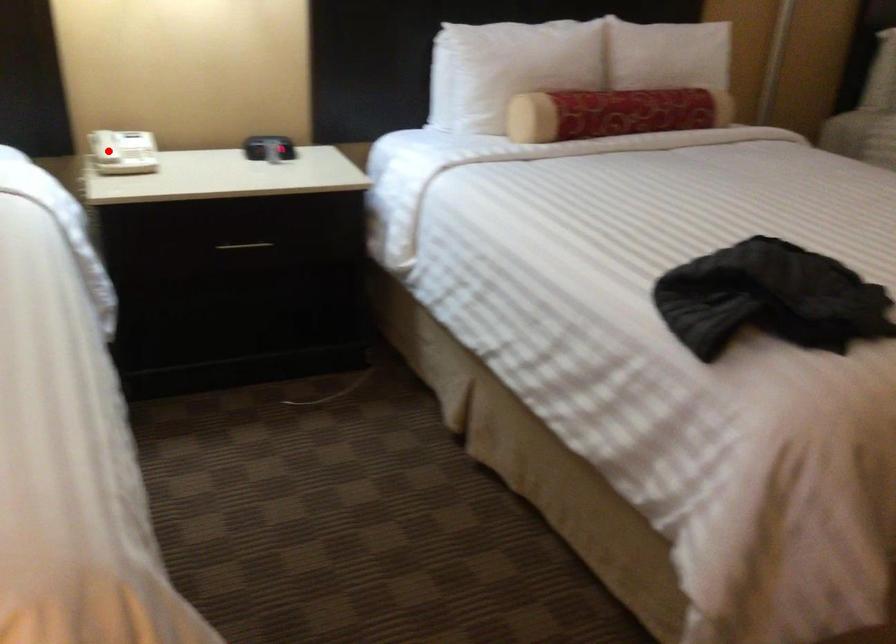
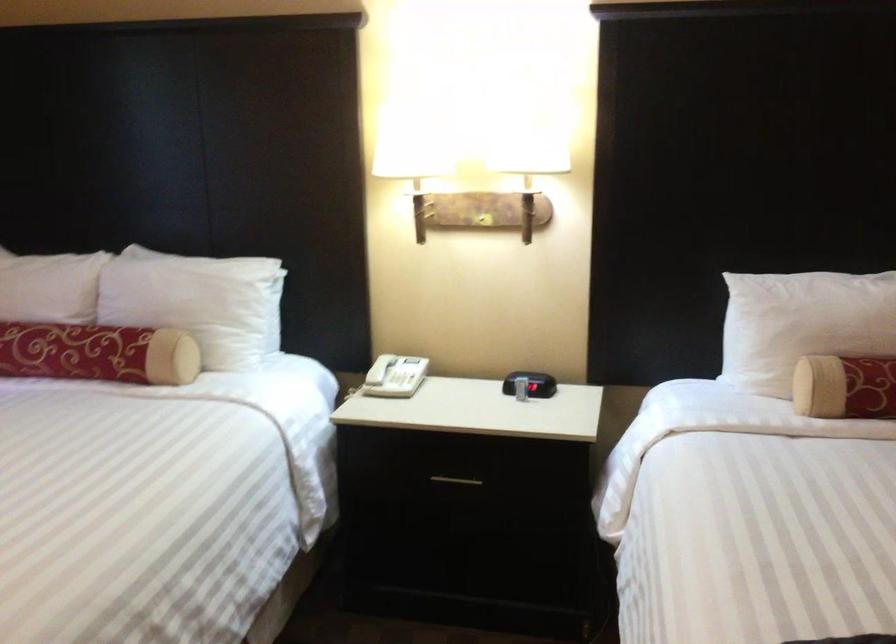
Question: I am providing you with two images of the same scene from different viewpoints. Given a red point in image1, look at the same physical point in image2. Is it:

Choices:
 (A) Closer to the viewpoint
 (B) Farther from the viewpoint

Answer: (B)